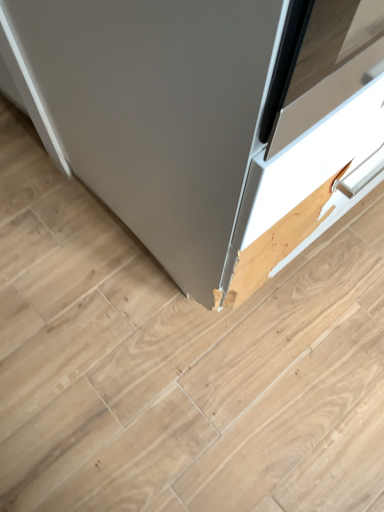
What do you see at coordinates (203, 114) in the screenshot? I see `satin gray cabinet at center` at bounding box center [203, 114].

Identify the location of satin gray cabinet at center. (203, 114).

At what (x,y) coordinates should I click in order to perform the action: click on satin gray cabinet at center. Please return your answer as a coordinate pair (x, y). The image size is (384, 512). Looking at the image, I should click on (203, 114).